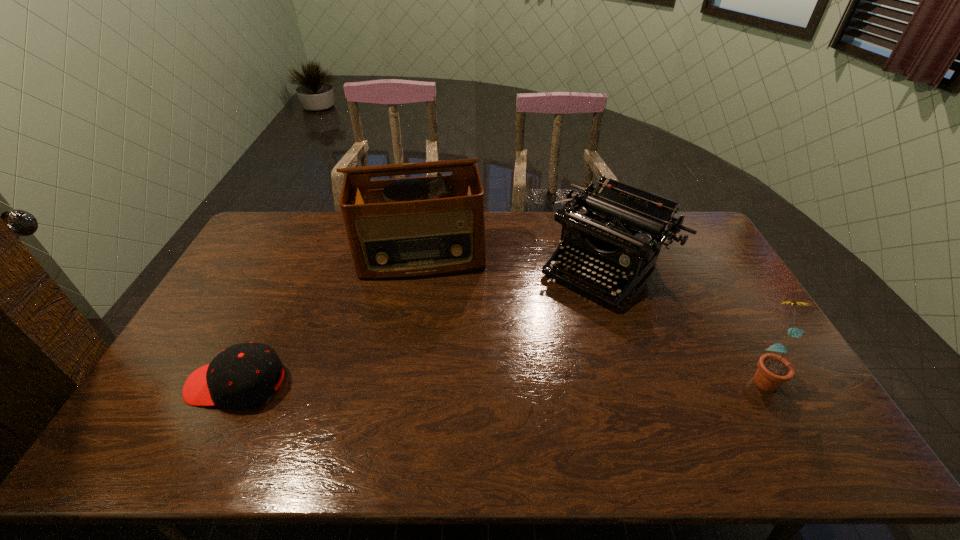
The image size is (960, 540). I want to click on unoccupied position between the third object from left to right and the cap, so click(421, 325).

Locate an element on the screen. The height and width of the screenshot is (540, 960). free point between the third object from left to right and the radio receiver is located at coordinates (514, 260).

I want to click on vacant space that's between the typewriter and the sunflower, so click(684, 320).

The width and height of the screenshot is (960, 540). Find the location of `free area in between the rightmost object and the third object from left to right`. free area in between the rightmost object and the third object from left to right is located at coordinates (684, 320).

Where is `free spot between the typewriter and the radio receiver`? Image resolution: width=960 pixels, height=540 pixels. free spot between the typewriter and the radio receiver is located at coordinates (514, 260).

Image resolution: width=960 pixels, height=540 pixels. I want to click on object that stands as the third closest to the third object from left to right, so click(243, 375).

At what (x,y) coordinates should I click in order to perform the action: click on object identified as the third closest to the sunflower. Please return your answer as a coordinate pair (x, y). Looking at the image, I should click on (243, 375).